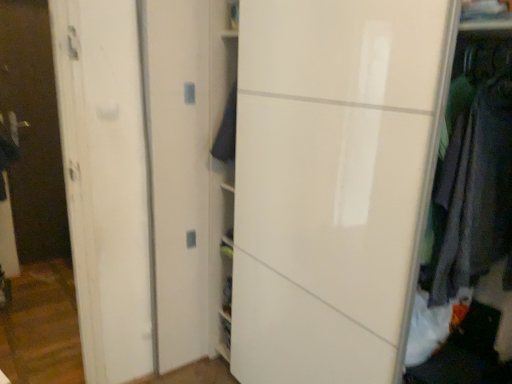
Question: From the image's perspective, is dark gray fabric at right, which appears as the 2th clothing when viewed from the back, below dark blue fabric at center, which is the 1th clothing from back to front?

Choices:
 (A) no
 (B) yes

Answer: (B)

Question: From a real-world perspective, is dark gray fabric at right, which appears as the 1th clothing when viewed from the front, on dark blue fabric at center, which ranks as the 1th clothing in left-to-right order?

Choices:
 (A) no
 (B) yes

Answer: (A)

Question: From the image's perspective, would you say dark gray fabric at right, marked as the 1th clothing in a right-to-left arrangement, is positioned over dark blue fabric at center, the second clothing when ordered from front to back?

Choices:
 (A) yes
 (B) no

Answer: (B)

Question: Is dark gray fabric at right, which is the 2th clothing from left to right, completely or partially outside of dark blue fabric at center, which is the 1th clothing from back to front?

Choices:
 (A) no
 (B) yes

Answer: (B)

Question: Considering the relative sizes of dark gray fabric at right, which appears as the 2th clothing when viewed from the back, and dark blue fabric at center, which is the 1th clothing from back to front, in the image provided, is dark gray fabric at right, which appears as the 2th clothing when viewed from the back, bigger than dark blue fabric at center, which is the 1th clothing from back to front,?

Choices:
 (A) no
 (B) yes

Answer: (B)

Question: Looking at the image, does dark gray fabric at right, which appears as the 1th clothing when viewed from the front, seem bigger or smaller compared to dark blue fabric at center, which ranks as the 1th clothing in left-to-right order?

Choices:
 (A) big
 (B) small

Answer: (A)

Question: From the image's perspective, relative to dark blue fabric at center, the second clothing viewed from the right, is dark gray fabric at right, which appears as the 2th clothing when viewed from the back, above or below?

Choices:
 (A) above
 (B) below

Answer: (B)

Question: Is dark gray fabric at right, which appears as the 2th clothing when viewed from the back, taller or shorter than dark blue fabric at center, the second clothing viewed from the right?

Choices:
 (A) tall
 (B) short

Answer: (A)

Question: Would you say dark gray fabric at right, which appears as the 2th clothing when viewed from the back, is to the left or to the right of dark blue fabric at center, the second clothing when ordered from front to back, in the picture?

Choices:
 (A) right
 (B) left

Answer: (A)

Question: Based on their sizes in the image, would you say dark gray fabric at right, which appears as the 2th clothing when viewed from the back, is bigger or smaller than transparent glass door at left?

Choices:
 (A) small
 (B) big

Answer: (A)

Question: Is point (466, 223) closer or farther from the camera than point (10, 51)?

Choices:
 (A) farther
 (B) closer

Answer: (B)

Question: From the image's perspective, is dark gray fabric at right, marked as the 1th clothing in a right-to-left arrangement, positioned above or below transparent glass door at left?

Choices:
 (A) below
 (B) above

Answer: (A)

Question: From a real-world perspective, is dark gray fabric at right, which appears as the 2th clothing when viewed from the back, physically located above or below transparent glass door at left?

Choices:
 (A) above
 (B) below

Answer: (A)

Question: In terms of height, does dark blue fabric at center, the second clothing viewed from the right, look taller or shorter compared to transparent glass door at left?

Choices:
 (A) tall
 (B) short

Answer: (B)

Question: Is dark blue fabric at center, the second clothing when ordered from front to back, wider or thinner than transparent glass door at left?

Choices:
 (A) wide
 (B) thin

Answer: (A)